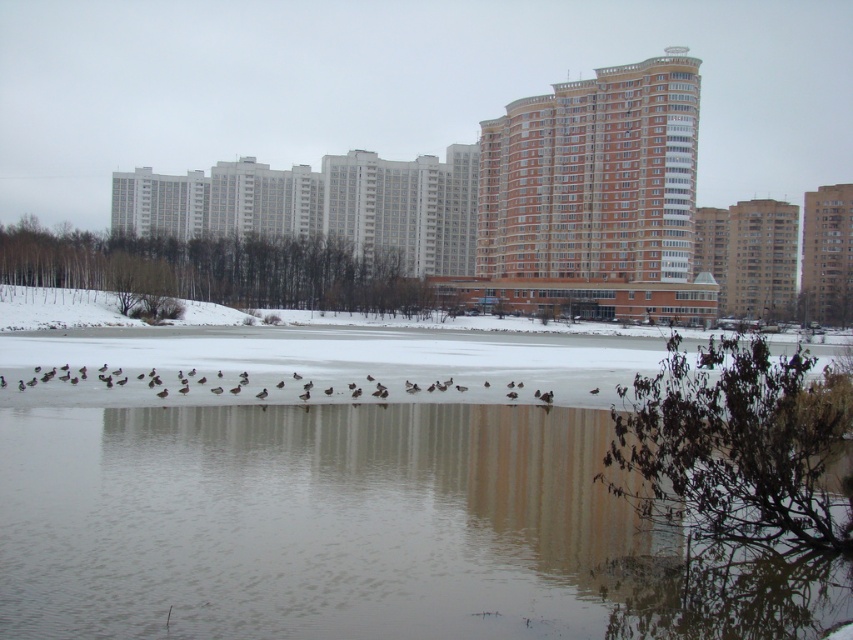
Which is in front, point (584, 444) or point (368, 388)?

Positioned in front is point (584, 444).

Is clear water at center to the right of brown matte birds at center from the viewer's perspective?

Yes, clear water at center is to the right of brown matte birds at center.

Between point (235, 634) and point (142, 378), which one is positioned behind?

Point (142, 378)

Identify the location of clear water at center. This screenshot has height=640, width=853. (358, 531).